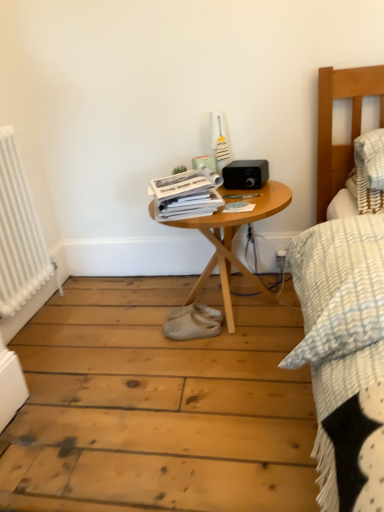
Question: Is woodenobject at center aimed at matte paper magazine at center, which ranks as the 2th magazine in left-to-right order?

Choices:
 (A) yes
 (B) no

Answer: (B)

Question: Considering the relative sizes of woodenobject at center and matte paper magazine at center, which is counted as the 1th magazine, starting from the right, in the image provided, is woodenobject at center smaller than matte paper magazine at center, which is counted as the 1th magazine, starting from the right,?

Choices:
 (A) yes
 (B) no

Answer: (B)

Question: Is woodenobject at center in contact with matte paper magazine at center, which ranks as the 2th magazine in left-to-right order?

Choices:
 (A) yes
 (B) no

Answer: (B)

Question: Considering the relative sizes of woodenobject at center and matte paper magazine at center, which ranks as the 2th magazine in left-to-right order, in the image provided, is woodenobject at center shorter than matte paper magazine at center, which ranks as the 2th magazine in left-to-right order,?

Choices:
 (A) no
 (B) yes

Answer: (A)

Question: Does woodenobject at center have a larger size compared to matte paper magazine at center, which is counted as the 1th magazine, starting from the right?

Choices:
 (A) yes
 (B) no

Answer: (A)

Question: From the image's perspective, is woodenobject at center below matte paper magazine at center, which is counted as the 1th magazine, starting from the right?

Choices:
 (A) yes
 (B) no

Answer: (A)

Question: Does white metallic radiator at left have a greater width compared to matte paper magazine at center, which ranks as the 2th magazine in left-to-right order?

Choices:
 (A) yes
 (B) no

Answer: (B)

Question: Can you confirm if white metallic radiator at left is taller than matte paper magazine at center, which ranks as the 2th magazine in left-to-right order?

Choices:
 (A) no
 (B) yes

Answer: (B)

Question: Does white metallic radiator at left appear on the right side of matte paper magazine at center, which is counted as the 1th magazine, starting from the right?

Choices:
 (A) no
 (B) yes

Answer: (A)

Question: Would you consider white metallic radiator at left to be distant from matte paper magazine at center, which ranks as the 2th magazine in left-to-right order?

Choices:
 (A) yes
 (B) no

Answer: (B)

Question: From the image's perspective, is white metallic radiator at left over matte paper magazine at center, which is counted as the 1th magazine, starting from the right?

Choices:
 (A) yes
 (B) no

Answer: (B)

Question: Can you confirm if white metallic radiator at left is positioned to the left of matte paper magazine at center, which is counted as the 1th magazine, starting from the right?

Choices:
 (A) no
 (B) yes

Answer: (B)

Question: Is white plastic electric outlet at lower right wider than matte paper magazine at center, which ranks as the 2th magazine in left-to-right order?

Choices:
 (A) no
 (B) yes

Answer: (A)